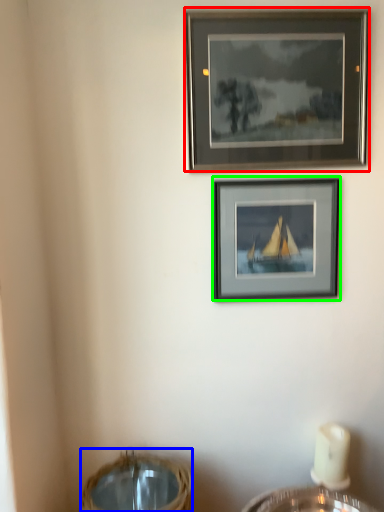
Question: Considering the real-world distances, which object is farthest from picture frame (highlighted by a red box)? basket (highlighted by a blue box) or picture frame (highlighted by a green box)?

Choices:
 (A) basket
 (B) picture frame

Answer: (A)